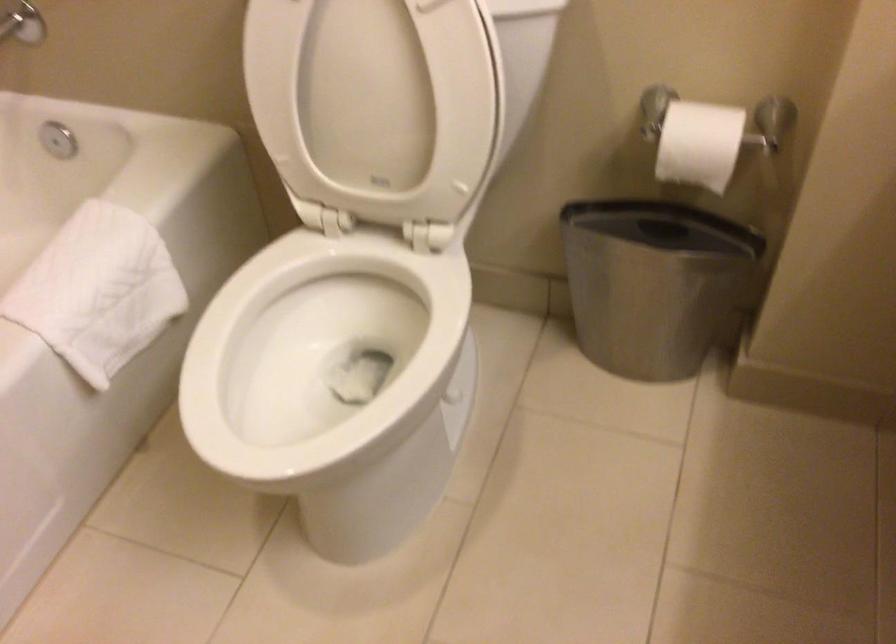
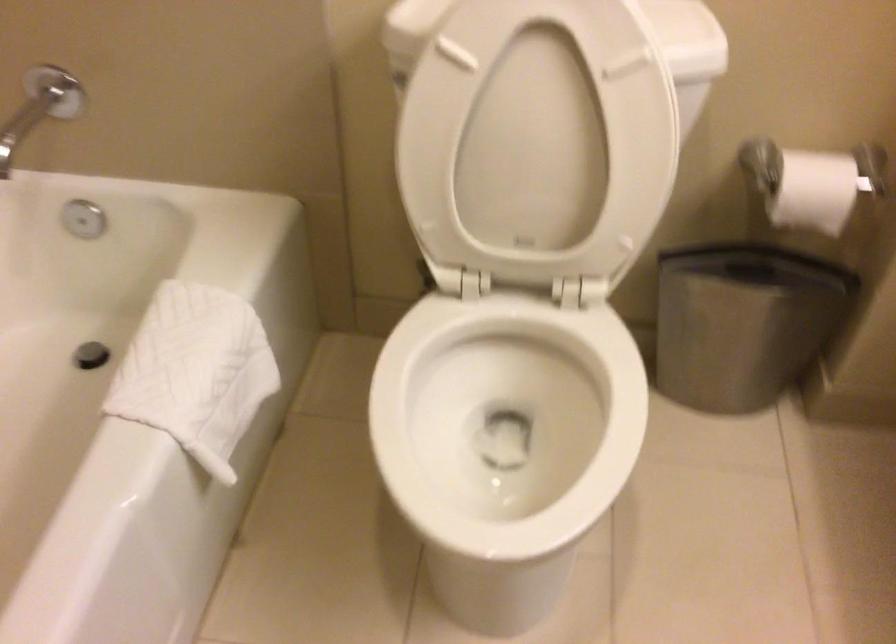
Question: Which direction would the cameraman need to move to produce the second image? Reply with the corresponding letter.

Choices:
 (A) Left
 (B) Right
 (C) Forward
 (D) Backward

Answer: (A)